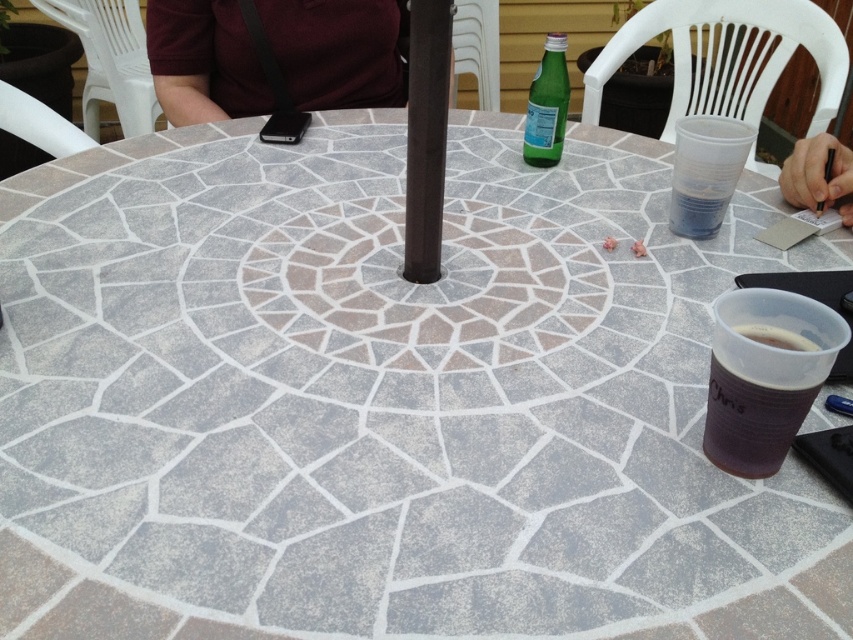
You are setting up a small garden table for a tea party and need to place a 30 cm wide tray between the black matte pole at center and the green glass bottle at upper center. Will there be enough space?

The distance between the black matte pole at center and the green glass bottle at upper center is 30.92 centimeters, so the 30 cm wide tray can fit with a small amount of space remaining.

You are standing in a garden and want to place a 20 inch long garden hose near the black matte pole at center. Can you fit the hose without it overlapping the pole?

The black matte pole at center and viewer are 22.73 inches apart from each other. Since the hose is 20 inches long, it can be placed near the pole without overlapping as there is enough space between them.

You are organizing a picnic and need to place both the dark red fabric at upper center and the black paper at upper right on a shelf. If the shelf has limited height space, which item should you place first to ensure both fit?

The dark red fabric at upper center is much taller than the black paper at upper right. To ensure both fit on the shelf with limited height space, place the taller dark red fabric at upper center first, then the shorter black paper at upper right.